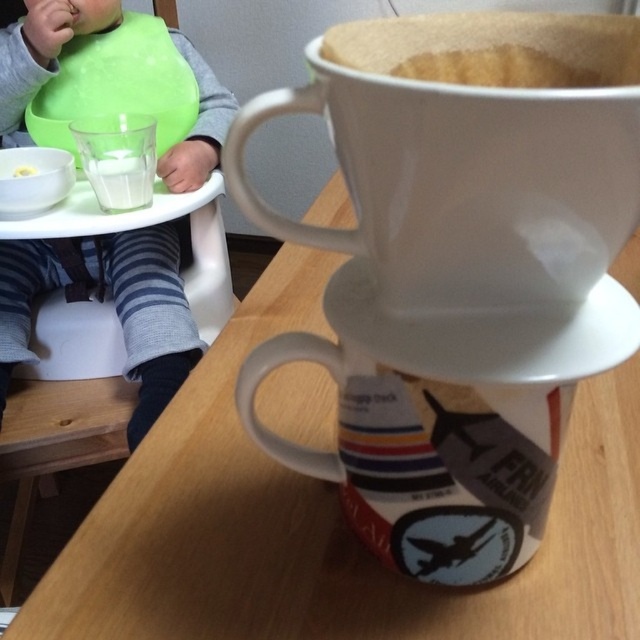
Question: Is wooden table at center bigger than white matte mug at upper center?

Choices:
 (A) no
 (B) yes

Answer: (B)

Question: In this image, where is wooden table at center located relative to white opaque liquid at upper left?

Choices:
 (A) above
 (B) below

Answer: (B)

Question: Can you confirm if white matte saucer at upper center is bigger than yellow matte spoon at upper left?

Choices:
 (A) yes
 (B) no

Answer: (A)

Question: Which point appears closest to the camera in this image?

Choices:
 (A) click(x=182, y=548)
 (B) click(x=38, y=260)
 (C) click(x=122, y=196)
 (D) click(x=420, y=358)

Answer: (D)

Question: Which is farther from the green bibbed baby at left?

Choices:
 (A) yellow matte spoon at upper left
 (B) white glossy mug at lower center
 (C) wooden table at center
 (D) white matte mug at upper center

Answer: (D)

Question: Which of the following is the closest to the observer?

Choices:
 (A) (54, 12)
 (B) (392, 221)
 (C) (438, 349)
 (D) (480, 564)

Answer: (B)